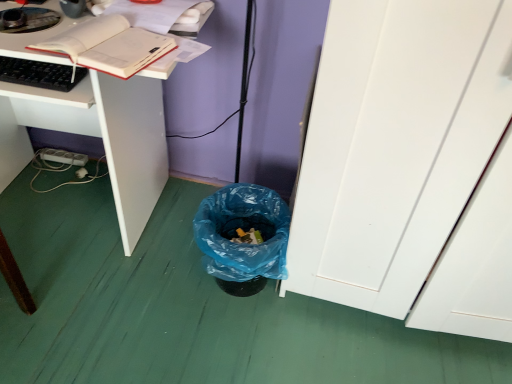
This screenshot has height=384, width=512. Describe the element at coordinates (40, 74) in the screenshot. I see `black matte keyboard at left` at that location.

Find the location of a particular element. matte white book at upper left is located at coordinates (109, 46).

The image size is (512, 384). Describe the element at coordinates (243, 243) in the screenshot. I see `blue plastic trash can at lower center` at that location.

You are a GUI agent. You are given a task and a screenshot of the screen. Output one action in this format:
    pyautogui.click(x=<x>, y=<y>)
    Task: Click on the black matte keyboard at left
    
    Given the screenshot: What is the action you would take?
    pyautogui.click(x=40, y=74)

From the image's perspective, is matte white book at upper left on top of blue plastic trash can at lower center?

Yes, from the image's perspective, matte white book at upper left is above blue plastic trash can at lower center.

Where is `book above the blue plastic trash can at lower center (from the image's perspective)`? Image resolution: width=512 pixels, height=384 pixels. book above the blue plastic trash can at lower center (from the image's perspective) is located at coordinates (109, 46).

Can you confirm if matte white book at upper left is wider than blue plastic trash can at lower center?

No, matte white book at upper left is not wider than blue plastic trash can at lower center.

Is matte white book at upper left with blue plastic trash can at lower center?

matte white book at upper left and blue plastic trash can at lower center are not in contact.

Choose the correct answer: Is blue plastic trash can at lower center inside matte white book at upper left or outside it?

blue plastic trash can at lower center is outside matte white book at upper left.

At what (x,y) coordinates should I click in order to perform the action: click on trash bin/can behind the matte white book at upper left. Please return your answer as a coordinate pair (x, y). The image size is (512, 384). Looking at the image, I should click on (243, 243).

Could you tell me if blue plastic trash can at lower center is turned towards matte white book at upper left?

No, blue plastic trash can at lower center is not facing towards matte white book at upper left.

Is blue plastic trash can at lower center with matte white book at upper left?

blue plastic trash can at lower center and matte white book at upper left are clearly separated.

Considering the relative sizes of black matte keyboard at left and white matte desk at lower left in the image provided, is black matte keyboard at left bigger than white matte desk at lower left?

Result: Actually, black matte keyboard at left might be smaller than white matte desk at lower left.

From their relative heights in the image, would you say black matte keyboard at left is taller or shorter than white matte desk at lower left?

black matte keyboard at left is shorter than white matte desk at lower left.

Is black matte keyboard at left outside of white matte desk at lower left?

No, black matte keyboard at left is inside or overlapping with white matte desk at lower left.

Which object is positioned more to the right, black matte keyboard at left or blue plastic trash can at lower center?

blue plastic trash can at lower center.

What's the angular difference between black matte keyboard at left and blue plastic trash can at lower center's facing directions?

3.79 degrees.

Which object is closer to the camera taking this photo, black matte keyboard at left or blue plastic trash can at lower center?

black matte keyboard at left is in front.

Considering the sizes of white matte desk at lower left and blue plastic trash can at lower center in the image, is white matte desk at lower left wider or thinner than blue plastic trash can at lower center?

Considering their sizes, white matte desk at lower left looks broader than blue plastic trash can at lower center.

Could you tell me if white matte desk at lower left is facing blue plastic trash can at lower center?

No, white matte desk at lower left is not oriented towards blue plastic trash can at lower center.

From a real-world perspective, is white matte desk at lower left positioned under blue plastic trash can at lower center based on gravity?

No, from a real-world perspective, white matte desk at lower left is not under blue plastic trash can at lower center.

In the scene shown: From the image's perspective, between white matte desk at lower left and blue plastic trash can at lower center, who is located below?

From the image's view, blue plastic trash can at lower center is below.

Which of these two, blue plastic trash can at lower center or white matte desk at lower left, is wider?

With larger width is white matte desk at lower left.

Can you confirm if blue plastic trash can at lower center is smaller than white matte desk at lower left?

Correct, blue plastic trash can at lower center occupies less space than white matte desk at lower left.

In the scene shown: Is blue plastic trash can at lower center positioned with its back to white matte desk at lower left?

blue plastic trash can at lower center is not turned away from white matte desk at lower left.

Is blue plastic trash can at lower center to the right of white matte desk at lower left from the viewer's perspective?

Yes, blue plastic trash can at lower center is to the right of white matte desk at lower left.

Looking at this image, from a real-world perspective, who is located higher, matte white book at upper left or white matte desk at lower left?

In real-world perspective, matte white book at upper left is above.

Looking at this image, how different are the orientations of matte white book at upper left and white matte desk at lower left in degrees?

12.6 degrees separate the facing orientations of matte white book at upper left and white matte desk at lower left.

Is matte white book at upper left positioned in front of white matte desk at lower left?

Yes, matte white book at upper left is closer to the viewer.

Image resolution: width=512 pixels, height=384 pixels. In order to click on trash bin/can below the matte white book at upper left (from a real-world perspective) in this screenshot , I will do `click(243, 243)`.

The image size is (512, 384). Identify the location of book above the blue plastic trash can at lower center (from a real-world perspective). (109, 46).

From the image, which object appears to be farther from blue plastic trash can at lower center, matte white book at upper left or black matte keyboard at left?

black matte keyboard at left is further to blue plastic trash can at lower center.

Based on their spatial positions, is blue plastic trash can at lower center or matte white book at upper left further from black matte keyboard at left?

Among the two, blue plastic trash can at lower center is located further to black matte keyboard at left.

Based on their spatial positions, is black matte keyboard at left or matte white book at upper left further from blue plastic trash can at lower center?

Among the two, black matte keyboard at left is located further to blue plastic trash can at lower center.

Looking at the image, which one is located closer to black matte keyboard at left, matte white book at upper left or white matte desk at lower left?

matte white book at upper left lies closer to black matte keyboard at left than the other object.

Looking at the image, which one is located further to white matte desk at lower left, blue plastic trash can at lower center or matte white book at upper left?

blue plastic trash can at lower center is further to white matte desk at lower left.

Based on their spatial positions, is white matte desk at lower left or matte white book at upper left further from black matte keyboard at left?

white matte desk at lower left is further to black matte keyboard at left.

Which object lies nearer to the anchor point black matte keyboard at left, blue plastic trash can at lower center or white matte desk at lower left?

Based on the image, white matte desk at lower left appears to be nearer to black matte keyboard at left.

Estimate the real-world distances between objects in this image. Which object is further from matte white book at upper left, blue plastic trash can at lower center or black matte keyboard at left?

blue plastic trash can at lower center.

The height and width of the screenshot is (384, 512). Identify the location of desk between matte white book at upper left and blue plastic trash can at lower center in the vertical direction. (98, 136).

Identify the location of desk between black matte keyboard at left and blue plastic trash can at lower center. (98, 136).

Identify the location of desk between black matte keyboard at left and matte white book at upper left from left to right. (98, 136).

The image size is (512, 384). I want to click on book between black matte keyboard at left and blue plastic trash can at lower center from left to right, so click(109, 46).